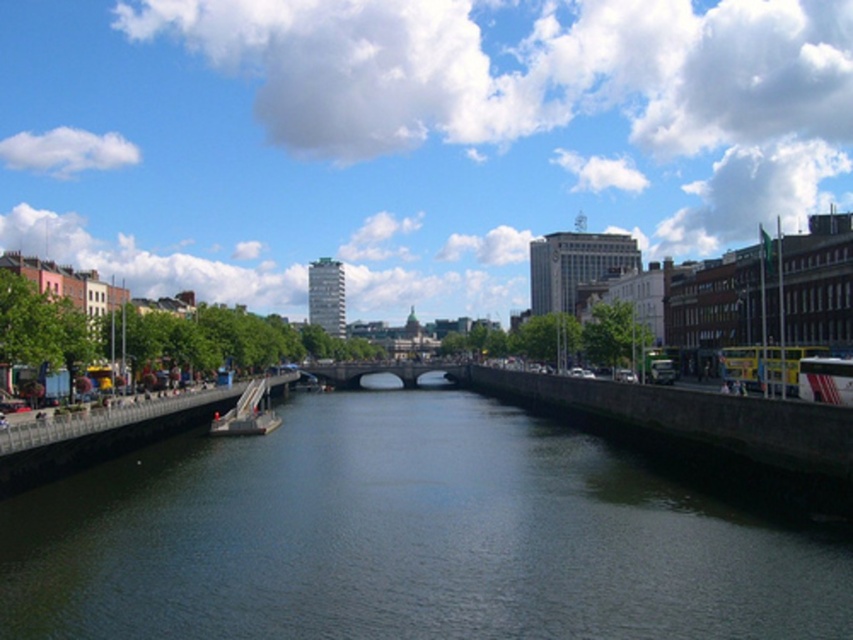
You are a city planner assessing the riverside area. You need to determine if the dark blue water at center can accommodate a new floating platform that requires a minimum area of 100 square meters. Given the dark gray stone bridge at center, can the water area be sufficient?

The dark blue water at center has a larger size compared to the dark gray stone bridge at center. Since the water is larger, it likely has enough area to accommodate the floating platform requiring 100 square meters.

You are standing on the pedestrian walkway on the left side of the river and want to cross to the embankment on the right. The dark gray stone bridge at center is your only option. Based on its location, can you reach the bridge from your current position?

Yes, the dark gray stone bridge at center is located at the center of the scene, so you can reach it from the pedestrian walkway on the left side of the river to cross over to the embankment on the right.

You are a city planner designing a new pedestrian walkway that needs to cross the river. You have two options for the bridge structure. The dark gray stone bridge at center is currently in place. The metallic gray boat at center is a potential alternative. Considering their widths, which option would allow more people to walk side by side comfortably?

The dark gray stone bridge at center has a larger width than the metallic gray boat at center, so it would allow more people to walk side by side comfortably.